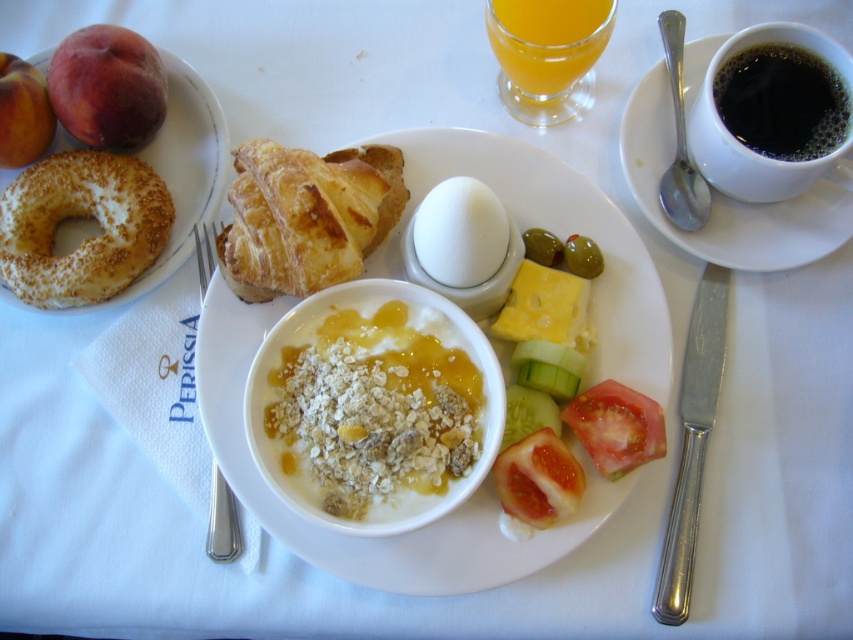
Question: Among these points, which one is nearest to the camera?

Choices:
 (A) (573, 70)
 (B) (804, 68)
 (C) (345, 218)
 (D) (154, 234)

Answer: (C)

Question: Is white smooth bowl at center to the right of translucent glass of orange juice at upper right from the viewer's perspective?

Choices:
 (A) no
 (B) yes

Answer: (A)

Question: Which object is farther from the camera taking this photo?

Choices:
 (A) red smooth tomato at lower center
 (B) juicy red tomato at lower right
 (C) translucent glass of orange juice at upper right
 (D) slightly toasted bagel at upper left

Answer: (D)

Question: Which of the following is the closest to the observer?

Choices:
 (A) (62, 184)
 (B) (740, 76)
 (C) (567, 320)
 (D) (67, 60)

Answer: (C)

Question: Is white smooth bowl at center in front of red smooth tomato at lower center?

Choices:
 (A) yes
 (B) no

Answer: (B)

Question: Can you confirm if golden brown flaky croissant at center is smaller than translucent glass of orange juice at upper right?

Choices:
 (A) no
 (B) yes

Answer: (A)